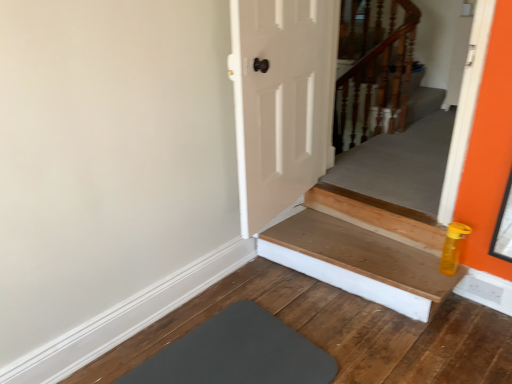
Locate an element on the screen. The height and width of the screenshot is (384, 512). free spot above gray rubber mat at lower left (from a real-world perspective) is located at coordinates (229, 357).